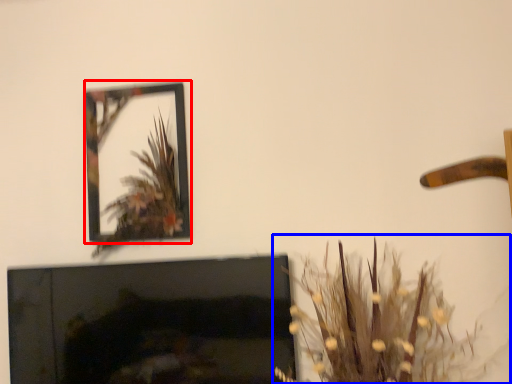
Question: Among these objects, which one is nearest to the camera, picture frame (highlighted by a red box) or houseplant (highlighted by a blue box)?

Choices:
 (A) picture frame
 (B) houseplant

Answer: (B)